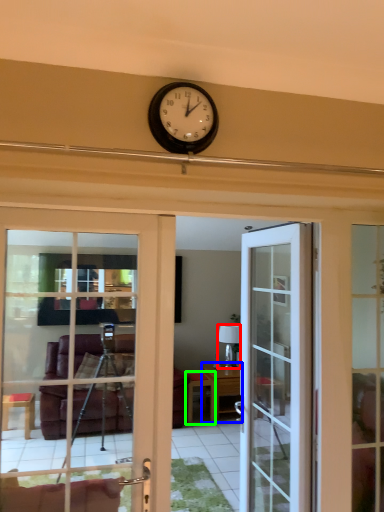
Question: Based on their relative distances, which object is farther from lamp (highlighted by a red box)? Choose from table (highlighted by a blue box) and table (highlighted by a green box).

Choices:
 (A) table
 (B) table

Answer: (B)